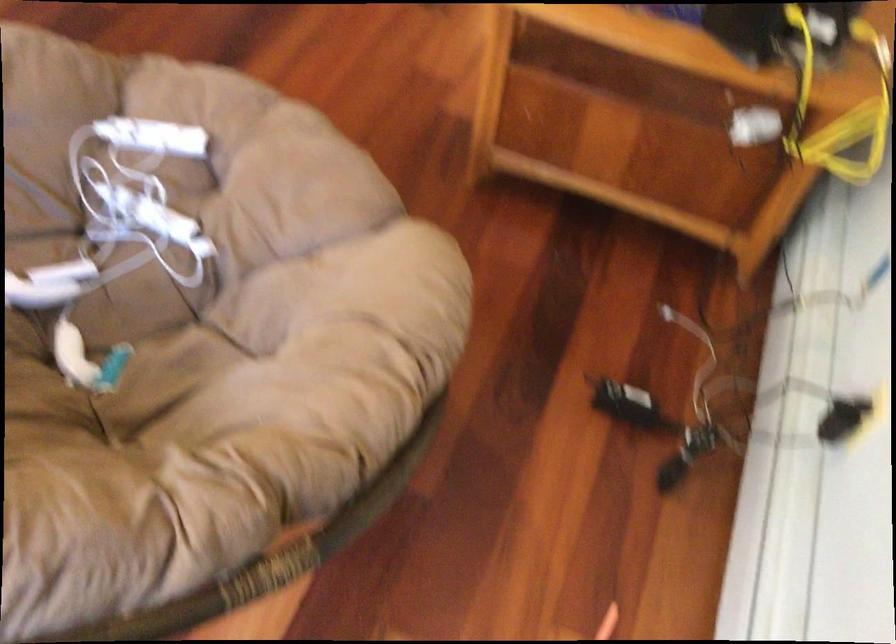
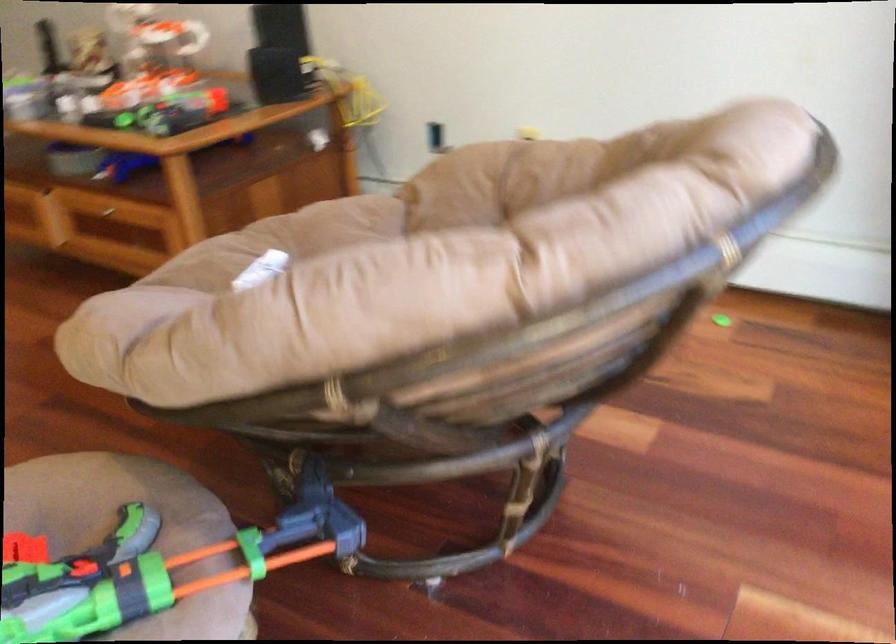
Question: I am providing you with two images of the same scene from different viewpoints. Which of the following objects are not visible in image2?

Choices:
 (A) chair sitting surface
 (B) toy gun handle
 (C) drawer handle
 (D) none of these

Answer: (D)